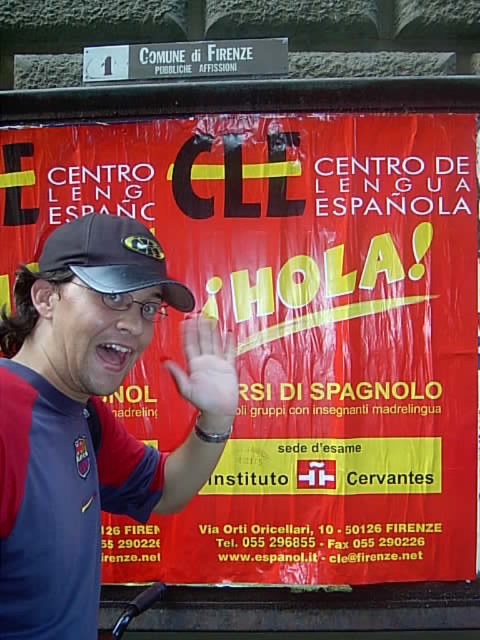
Question: Which object appears closest to the camera in this image?

Choices:
 (A) dark blue jersey at center
 (B) matte black cap at center

Answer: (A)

Question: Is red vinyl banner at center wider than skinny white hand at center?

Choices:
 (A) yes
 (B) no

Answer: (A)

Question: Is matte black cap at center above skinny white hand at center?

Choices:
 (A) no
 (B) yes

Answer: (B)

Question: Among these objects, which one is nearest to the camera?

Choices:
 (A) skinny white hand at center
 (B) dark blue jersey at center
 (C) red vinyl banner at center

Answer: (B)

Question: Is dark blue jersey at center closer to the viewer compared to skinny white hand at center?

Choices:
 (A) yes
 (B) no

Answer: (A)

Question: Estimate the real-world distances between objects in this image. Which object is closer to the matte black cap at center?

Choices:
 (A) skinny white hand at center
 (B) dark blue jersey at center

Answer: (A)